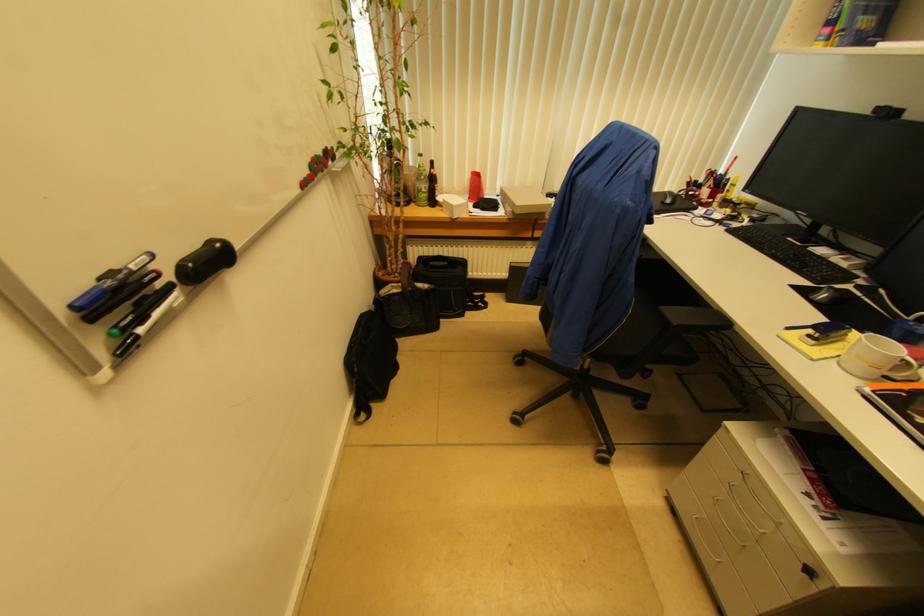
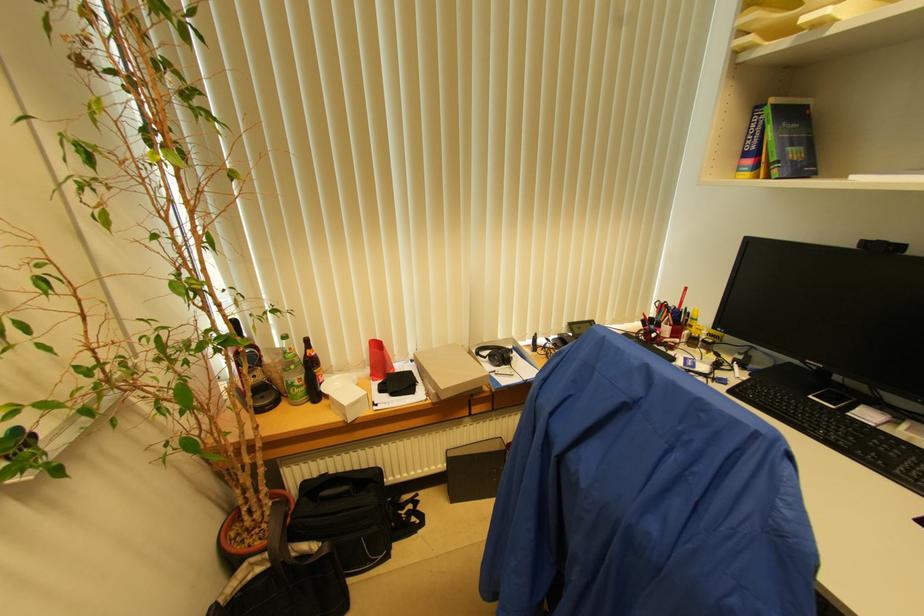
Locate, in the second image, the point that corresponds to [888,116] in the first image.

(882, 251)